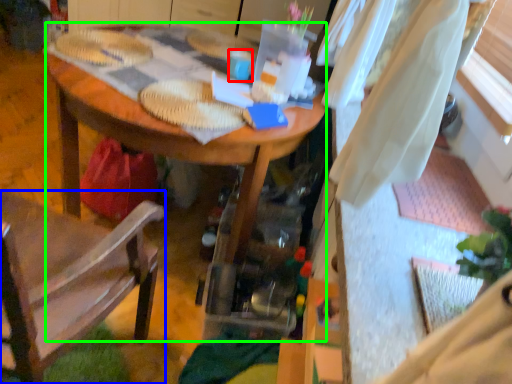
Question: Based on their relative distances, which object is farther from coffee cup (highlighted by a red box)? Choose from chair (highlighted by a blue box) and desk (highlighted by a green box).

Choices:
 (A) chair
 (B) desk

Answer: (A)